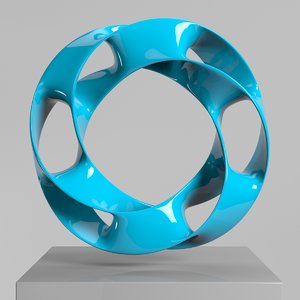
Where is `wall`? Image resolution: width=300 pixels, height=300 pixels. wall is located at coordinates (144, 144).